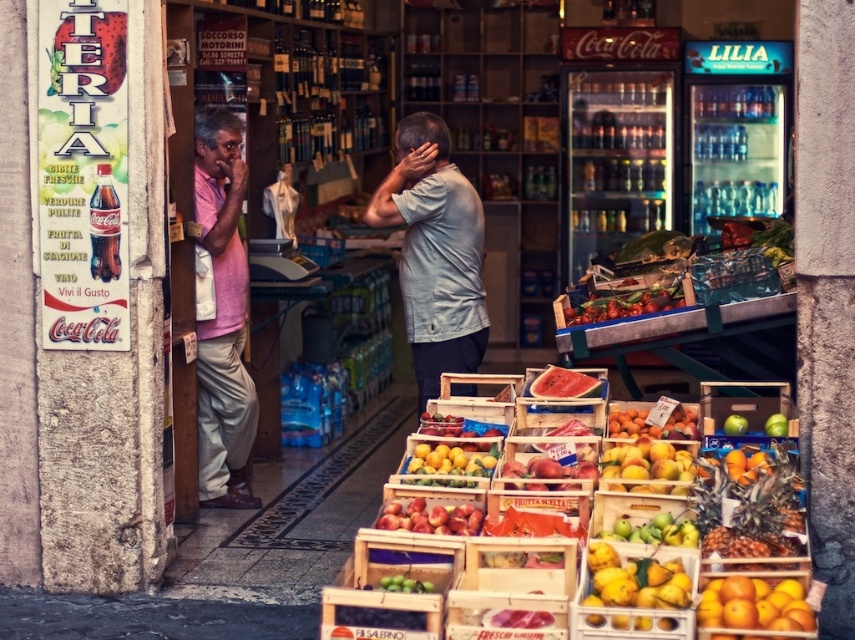
Please look at the image and identify the object located at the coordinate point (753, 604). The scene includes a Coca Cola advertisement on a stone wall on the left, two men conversing inside the store, and other items. What is the object at that specific coordinate?

The object at coordinate point (753, 604) is the orange matte fruit at lower right.

In the scene shown: You are a customer looking to buy fruits. You see the shiny red tomatoes at center and the green matte pears at center. Which one is placed higher?

The shiny red tomatoes at center is located above the green matte pears at center, so the shiny red tomatoes at center is placed higher.

You are a customer looking for the yellow matte pears at center in the store. You see the pink cotton shirt at left worn by a man. Which object is closer to the entrance?

The pink cotton shirt at left is closer to the entrance because it is located above the yellow matte pears at center, indicating it is nearer to the front of the store.